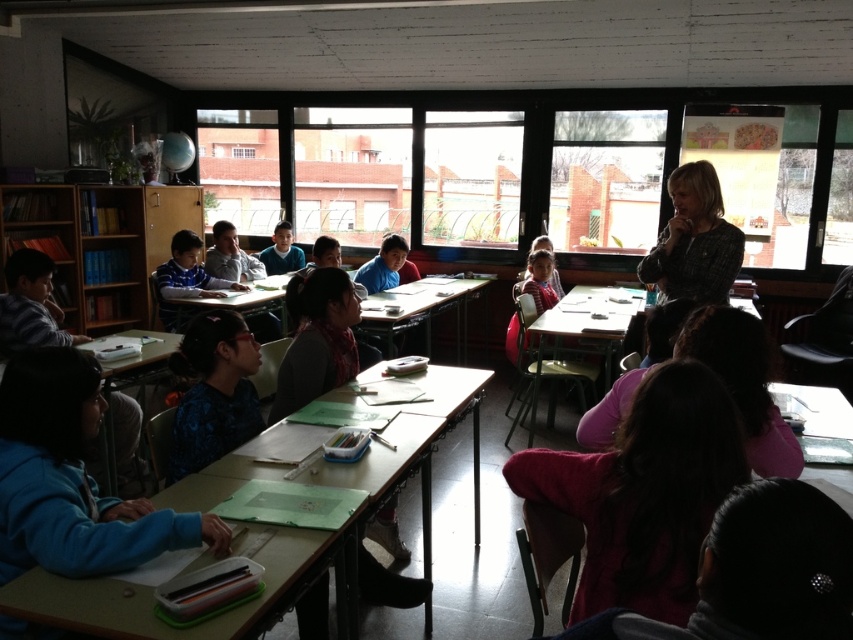
Does wooden desk at lower left appear on the right side of wooden desk at center?

Incorrect, wooden desk at lower left is not on the right side of wooden desk at center.

Can you confirm if wooden desk at lower left is thinner than wooden desk at center?

No.

Does point (51, 596) come farther from viewer compared to point (422, 285)?

No, it is in front of (422, 285).

I want to click on wooden desk at lower left, so click(x=289, y=532).

Between wooden desk at lower left and plaid fabric teacher at upper right, which one is positioned lower?

wooden desk at lower left is lower down.

This screenshot has height=640, width=853. What do you see at coordinates (289, 532) in the screenshot?
I see `wooden desk at lower left` at bounding box center [289, 532].

Find the location of a particular element. wooden desk at lower left is located at coordinates (289, 532).

Locate an element on the screen. wooden desk at lower left is located at coordinates (289, 532).

Who is taller, wooden bookshelf at left or plaid fabric teacher at upper right?

Standing taller between the two is wooden bookshelf at left.

Is point (198, 198) positioned behind point (693, 182)?

Yes, it is behind point (693, 182).

Is point (91, 230) behind point (674, 294)?

Yes, it is.

In order to click on wooden bookshelf at left in this screenshot , I will do `click(99, 244)`.